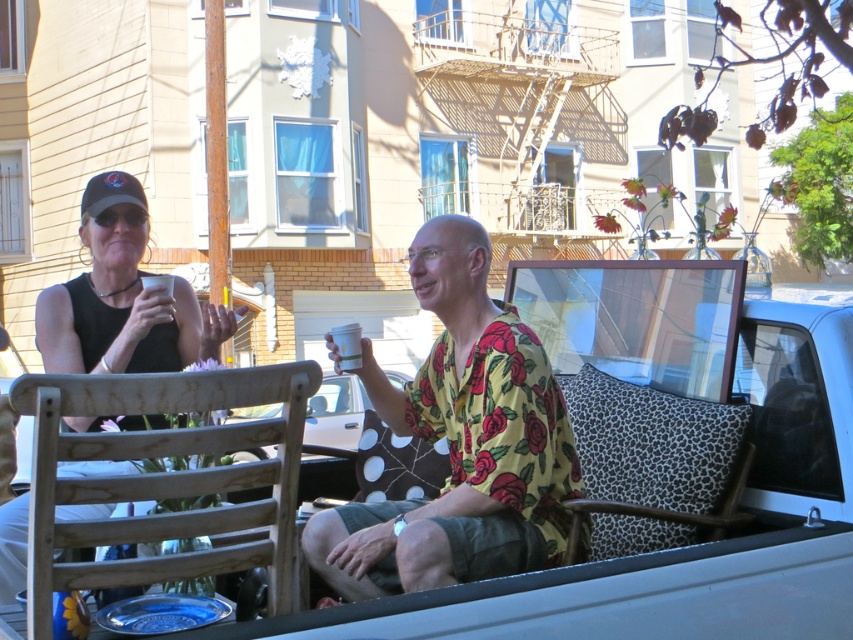
You are designing a new truck bed layout and need to know the relative sizes of the yellow floral shirt at center and the wooden chair at center. Which object is wider?

The yellow floral shirt at center is wider than the wooden chair at center according to the description.

You are standing in front of the image and want to locate the matte black tank top at left. According to the coordinates provided, where exactly should you look on the image to find it?

The matte black tank top at left is located at the 2D coordinates point (123,298) on the image.